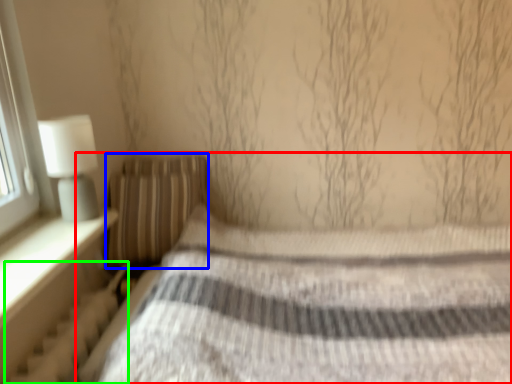
Question: Which object is the farthest from bed (highlighted by a red box)? Choose among these: pillow (highlighted by a blue box) or radiator (highlighted by a green box).

Choices:
 (A) pillow
 (B) radiator

Answer: (B)